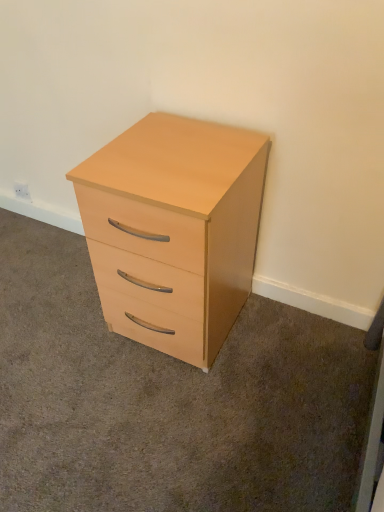
Where is `vacant area on top of light wood/finish chest of drawers at center (from a real-world perspective)`? The width and height of the screenshot is (384, 512). vacant area on top of light wood/finish chest of drawers at center (from a real-world perspective) is located at coordinates (176, 148).